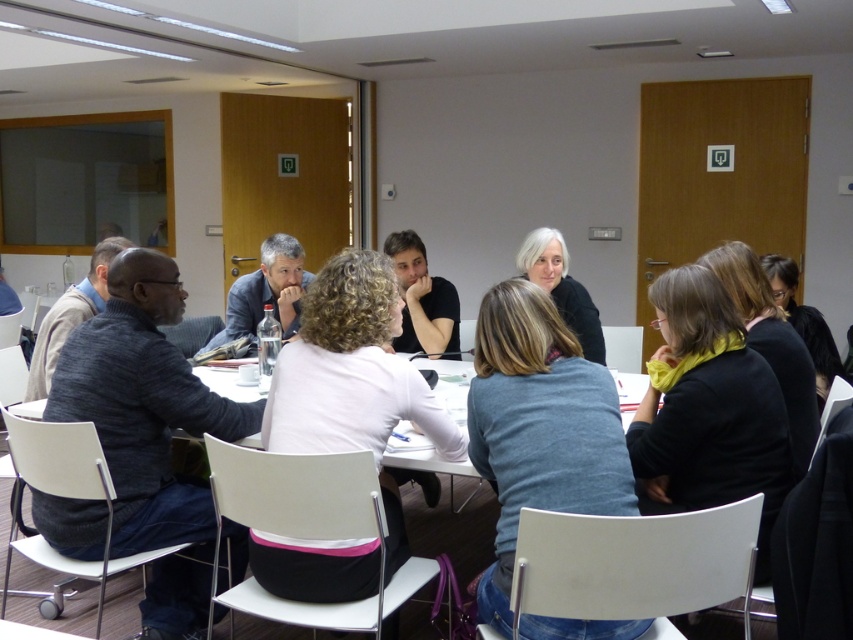
You are organizing a presentation and need to adjust the seating arrangement. The presenter wants to move closer to the dark gray sweater at left and the light pink fabric shirt at center. Based on their current positions, which direction should the presenter move to be closer to both?

The presenter should move to the left since the dark gray sweater at left is below the light pink fabric shirt at center, meaning moving left would bring them closer to both.